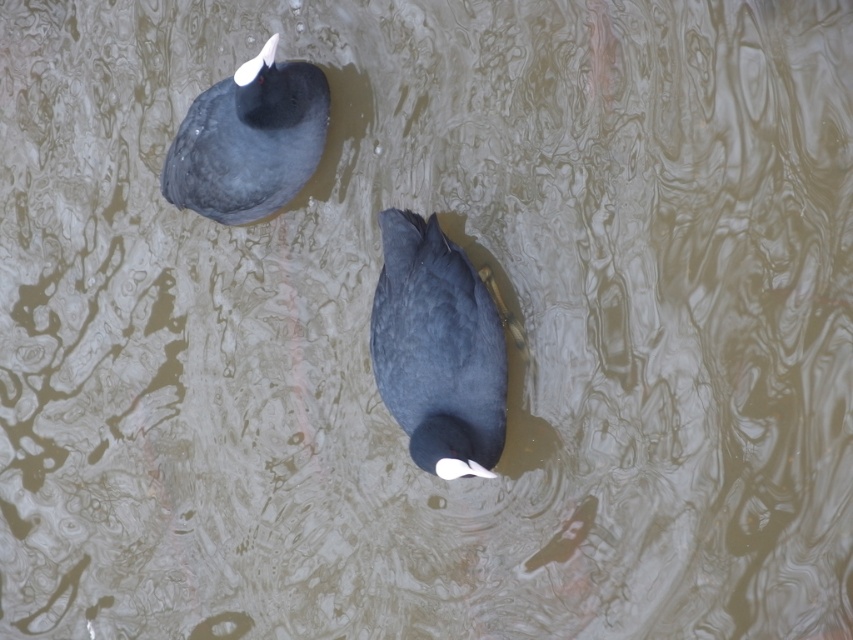
From the picture: You are a wildlife photographer aiming to capture both the matte black duck at center and the matte black duck at upper left in a single shot. Given their sizes, which duck will appear larger in your photo?

The matte black duck at upper left will appear larger in the photo because it is bigger than the matte black duck at center.

You are a birdwatcher observing two points on a map corresponding to the locations of the two black birds in the image. Which point is closer to you, point [419,417] or point [260,211]?

Point [419,417] is in front of point [260,211], so it is closer to you.